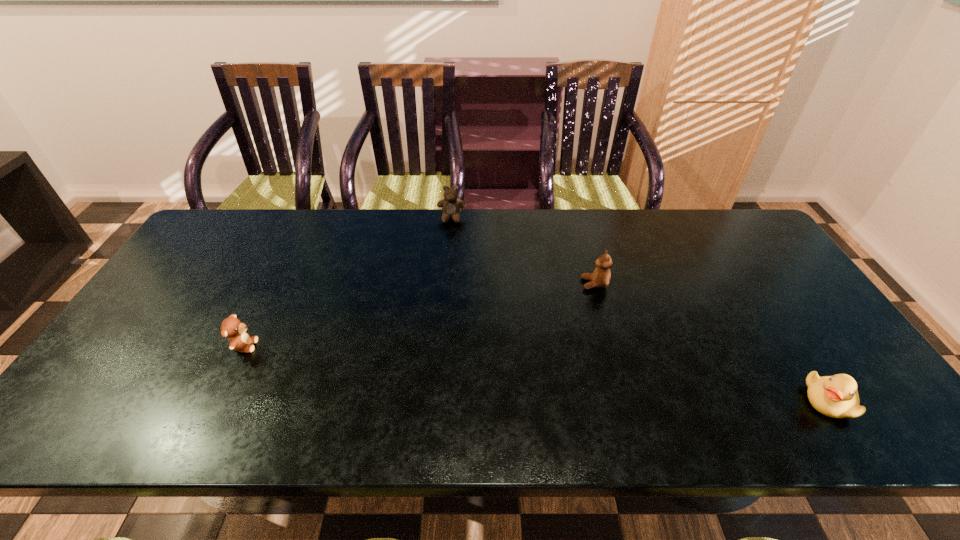
Identify the location of free spot between the farthest object and the rightmost object. This screenshot has width=960, height=540. (640, 309).

Locate an element on the screen. vacant point located between the shortest teddy bear and the second teddy bear from left to right is located at coordinates (348, 282).

This screenshot has height=540, width=960. In order to click on vacant space in between the rightmost teddy bear and the rightmost object in this screenshot , I will do `click(712, 342)`.

The image size is (960, 540). I want to click on vacant area that lies between the rightmost object and the second object from left to right, so click(640, 309).

Find the location of `the second closest object to the rightmost object`. the second closest object to the rightmost object is located at coordinates (451, 206).

Select which object appears as the third closest to the farthest teddy bear. Please provide its 2D coordinates. Your answer should be formatted as a tuple, i.e. [(x, y)], where the tuple contains the x and y coordinates of a point satisfying the conditions above.

[(836, 396)]

Identify the location of teddy bear that is the second closest one to the third nearest object. The image size is (960, 540). (233, 328).

The height and width of the screenshot is (540, 960). I want to click on teddy bear that stands as the closest to the third object from right to left, so click(601, 277).

Identify the location of free space that satisfies the following two spatial constraints: 1. on the face of the farthest teddy bear; 2. on the face of the leftmost object. The image size is (960, 540). (442, 346).

Locate an element on the screen. The image size is (960, 540). vacant space that satisfies the following two spatial constraints: 1. on the face of the third object from right to left; 2. on the face of the leftmost teddy bear is located at coordinates (442, 346).